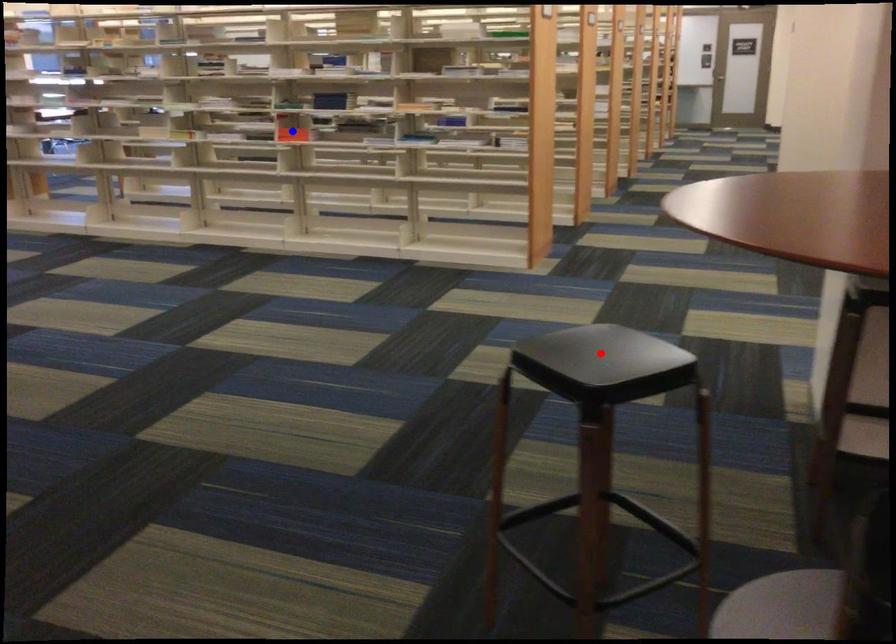
Question: Two points are marked on the image. Which point is closer to the camera?

Choices:
 (A) Blue point is closer.
 (B) Red point is closer.

Answer: (B)